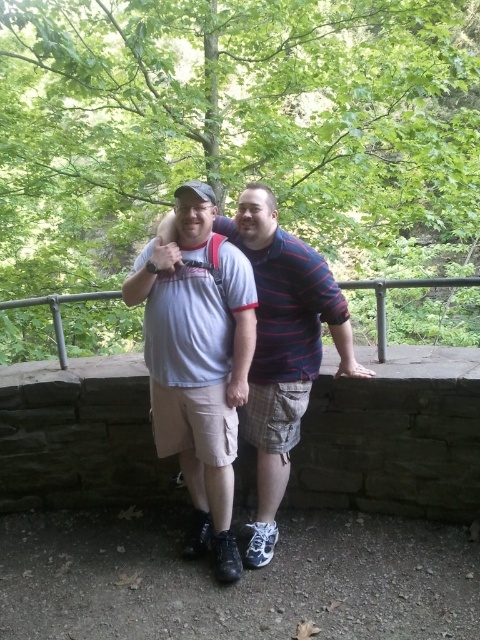
Question: Which point appears farthest from the camera in this image?

Choices:
 (A) (347, 282)
 (B) (262, 316)

Answer: (A)

Question: Considering the relative positions of white cotton shirt at center and metal/rustic rail at center in the image provided, where is white cotton shirt at center located with respect to metal/rustic rail at center?

Choices:
 (A) left
 (B) right

Answer: (A)

Question: Does white cotton shirt at center have a larger size compared to metal/rustic rail at center?

Choices:
 (A) yes
 (B) no

Answer: (A)

Question: Is white cotton shirt at center wider than metal/rustic rail at center?

Choices:
 (A) no
 (B) yes

Answer: (B)

Question: Among these points, which one is nearest to the camera?

Choices:
 (A) (334, 278)
 (B) (62, 368)

Answer: (A)